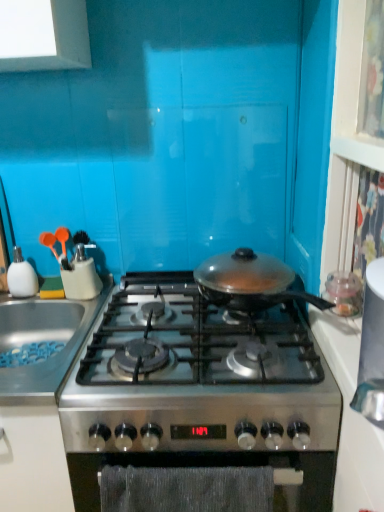
What do you see at coordinates (21, 276) in the screenshot? This screenshot has height=512, width=384. I see `white glossy soap dispenser at left` at bounding box center [21, 276].

This screenshot has height=512, width=384. I want to click on white glossy countertop at right, so click(351, 418).

What do you see at coordinates (351, 418) in the screenshot? I see `white glossy countertop at right` at bounding box center [351, 418].

This screenshot has width=384, height=512. What do you see at coordinates (214, 466) in the screenshot? I see `textured gray oven at center` at bounding box center [214, 466].

This screenshot has height=512, width=384. I want to click on textured gray oven at center, so click(x=214, y=466).

Where is `stainless steel sink at left`? Image resolution: width=384 pixels, height=512 pixels. stainless steel sink at left is located at coordinates (44, 340).

From the image's perspective, relative to white glossy soap dispenser at left, is textured gray oven at center above or below?

Clearly, from the image's perspective, textured gray oven at center is below white glossy soap dispenser at left.

Does point (209, 461) appear closer or farther from the camera than point (18, 266)?

Point (209, 461) is positioned closer to the camera compared to point (18, 266).

Can you tell me how much textured gray oven at center and white glossy soap dispenser at left differ in facing direction?

The angular difference between textured gray oven at center and white glossy soap dispenser at left is 4.32 degrees.

From a real-world perspective, which is physically above, textured gray oven at center or white glossy soap dispenser at left?

white glossy soap dispenser at left, from a real-world perspective.

Considering the relative sizes of textured gray oven at center and stainless steel sink at left in the image provided, is textured gray oven at center shorter than stainless steel sink at left?

Incorrect, the height of textured gray oven at center does not fall short of that of stainless steel sink at left.

Is textured gray oven at center far away from stainless steel sink at left?

No, there isn't a large distance between textured gray oven at center and stainless steel sink at left.

From the image's perspective, is textured gray oven at center on stainless steel sink at left?

Incorrect, from the image's perspective, textured gray oven at center is lower than stainless steel sink at left.

From a real-world perspective, is textured gray oven at center over stainless steel sink at left?

No, from a real-world perspective, textured gray oven at center is not above stainless steel sink at left.

Between white glossy countertop at right and stainless steel gas stove at center, which one has larger width?

Wider between the two is stainless steel gas stove at center.

Which object is further away from the camera, white glossy countertop at right or stainless steel gas stove at center?

stainless steel gas stove at center.

Does white glossy countertop at right turn towards stainless steel gas stove at center?

Yes, white glossy countertop at right is facing stainless steel gas stove at center.

Visually, is stainless steel gas stove at center positioned to the left or to the right of textured gray oven at center?

Clearly, stainless steel gas stove at center is on the right of textured gray oven at center in the image.

Can you confirm if stainless steel gas stove at center is shorter than textured gray oven at center?

Yes.

Is stainless steel gas stove at center positioned with its back to textured gray oven at center?

No, textured gray oven at center is not at the back of stainless steel gas stove at center.

From the image's perspective, would you say stainless steel gas stove at center is positioned over textured gray oven at center?

Yes.

Where is `oven located underneath the white glossy countertop at right (from a real-world perspective)`? The image size is (384, 512). oven located underneath the white glossy countertop at right (from a real-world perspective) is located at coordinates (214, 466).

Is white glossy countertop at right taller or shorter than textured gray oven at center?

In the image, white glossy countertop at right appears to be shorter than textured gray oven at center.

How distant is white glossy countertop at right from textured gray oven at center?

They are 8.56 inches apart.

Is white glossy countertop at right located outside textured gray oven at center?

Indeed, white glossy countertop at right is completely outside textured gray oven at center.

From a real-world perspective, is white glossy soap dispenser at left physically located above or below stainless steel gas stove at center?

white glossy soap dispenser at left is above stainless steel gas stove at center.

From the image's perspective, which one is positioned lower, white glossy soap dispenser at left or stainless steel gas stove at center?

stainless steel gas stove at center.

Are white glossy soap dispenser at left and stainless steel gas stove at center beside each other?

No, white glossy soap dispenser at left is not beside stainless steel gas stove at center.

Considering the relative positions of white glossy soap dispenser at left and stainless steel gas stove at center in the image provided, is white glossy soap dispenser at left to the left of stainless steel gas stove at center from the viewer's perspective?

Yes.

How far apart are textured gray oven at center and white glossy countertop at right?

They are 8.56 inches apart.

From the picture: Which is closer to the camera, (311, 467) or (322, 347)?

Point (311, 467)

From the image's perspective, which one is positioned higher, textured gray oven at center or white glossy countertop at right?

white glossy countertop at right, from the image's perspective.

Can you tell me how much textured gray oven at center and white glossy countertop at right differ in facing direction?

89.6 degrees separate the facing orientations of textured gray oven at center and white glossy countertop at right.

Locate an element on the screen. kitchen appliance above the textured gray oven at center (from the image's perspective) is located at coordinates (21, 276).

Find the location of a particular element. This screenshot has height=512, width=384. sink above the textured gray oven at center (from a real-world perspective) is located at coordinates (44, 340).

Estimate the real-world distances between objects in this image. Which object is further from stainless steel gas stove at center, textured gray oven at center or stainless steel sink at left?

The object further to stainless steel gas stove at center is stainless steel sink at left.

Looking at the image, which one is located further to stainless steel gas stove at center, stainless steel sink at left or white glossy soap dispenser at left?

white glossy soap dispenser at left is positioned further to the anchor stainless steel gas stove at center.

Estimate the real-world distances between objects in this image. Which object is further from stainless steel sink at left, white glossy soap dispenser at left or white glossy countertop at right?

The object further to stainless steel sink at left is white glossy countertop at right.

Considering their positions, is white glossy soap dispenser at left positioned closer to stainless steel sink at left than stainless steel gas stove at center?

white glossy soap dispenser at left is positioned closer to the anchor stainless steel sink at left.

Considering their positions, is textured gray oven at center positioned further to stainless steel gas stove at center than white glossy countertop at right?

white glossy countertop at right.

Based on their spatial positions, is stainless steel sink at left or stainless steel gas stove at center closer to white glossy countertop at right?

stainless steel gas stove at center is closer to white glossy countertop at right.

Estimate the real-world distances between objects in this image. Which object is closer to stainless steel sink at left, white glossy countertop at right or stainless steel gas stove at center?

stainless steel gas stove at center is positioned closer to the anchor stainless steel sink at left.

Which object lies further to the anchor point stainless steel gas stove at center, white glossy countertop at right or white glossy soap dispenser at left?

Among the two, white glossy soap dispenser at left is located further to stainless steel gas stove at center.

The height and width of the screenshot is (512, 384). Identify the location of sink between white glossy soap dispenser at left and textured gray oven at center in the horizontal direction. (44, 340).

The height and width of the screenshot is (512, 384). I want to click on gas stove located between textured gray oven at center and white glossy countertop at right in the left-right direction, so click(x=200, y=391).

Image resolution: width=384 pixels, height=512 pixels. I want to click on oven between stainless steel sink at left and stainless steel gas stove at center, so click(x=214, y=466).

Locate an element on the screen. oven situated between white glossy soap dispenser at left and stainless steel gas stove at center from left to right is located at coordinates (214, 466).